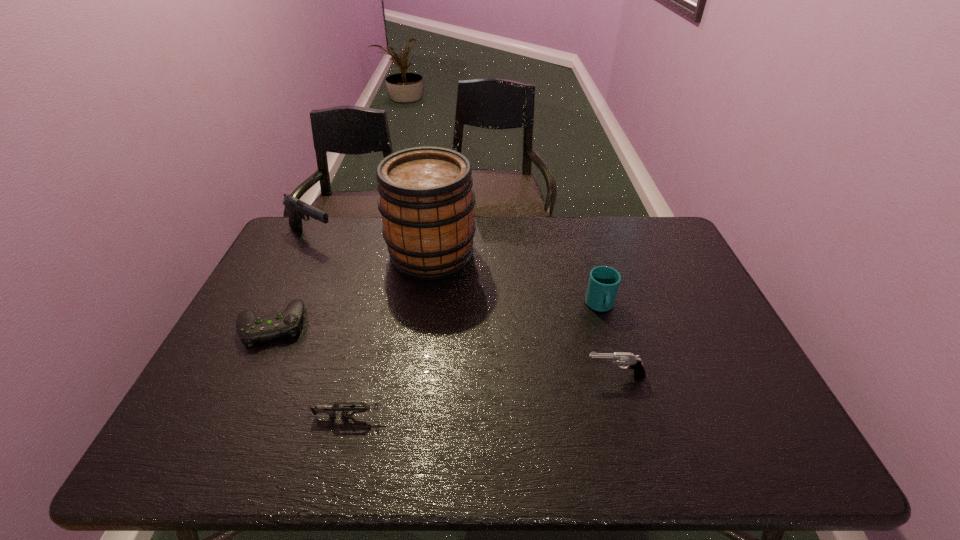
This screenshot has height=540, width=960. I want to click on the second closest gun to the nearest object, so click(297, 209).

Identify the location of gun that is the closest one to the rightmost gun. The width and height of the screenshot is (960, 540). (358, 407).

The width and height of the screenshot is (960, 540). Identify the location of free space that satisfies the following two spatial constraints: 1. at the muzzle of the control; 2. on the right side of the leftmost gun. pos(270,325).

This screenshot has width=960, height=540. Find the location of `free location that satisfies the following two spatial constraints: 1. at the muzzle of the leftmost gun; 2. on the back side of the tallest object`. free location that satisfies the following two spatial constraints: 1. at the muzzle of the leftmost gun; 2. on the back side of the tallest object is located at coordinates (303, 254).